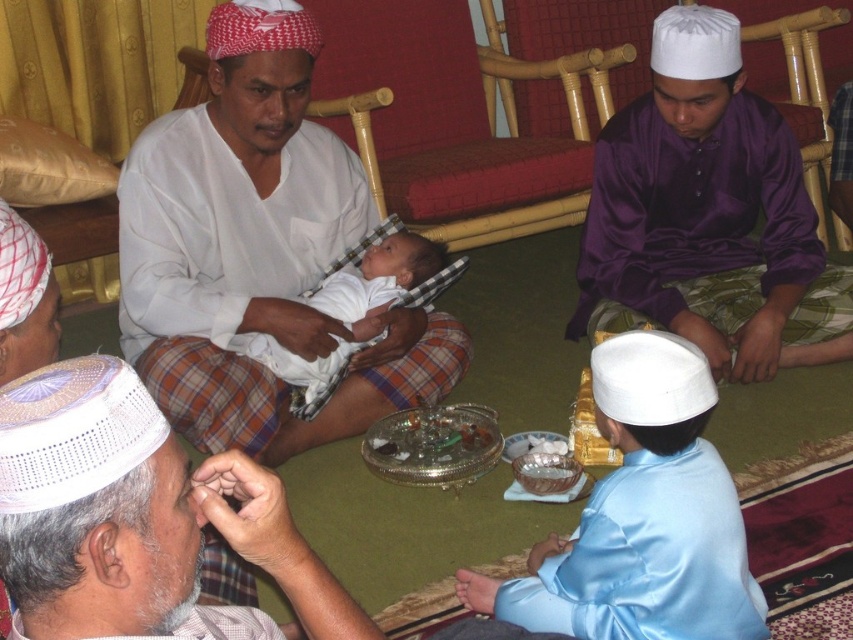
Question: Is white matte shirt at center below purple satin shirt at center?

Choices:
 (A) no
 (B) yes

Answer: (B)

Question: Which point is closer to the camera?

Choices:
 (A) (592, 608)
 (B) (328, 314)

Answer: (A)

Question: Observing the image, what is the correct spatial positioning of white woven cap at lower left in reference to light blue satin robe at lower right?

Choices:
 (A) right
 (B) left

Answer: (B)

Question: Which object is farther from the camera taking this photo?

Choices:
 (A) light blue satin robe at lower right
 (B) white woven cap at lower left
 (C) white cloth baby at center

Answer: (C)

Question: Does light blue satin robe at lower right appear on the left side of white cloth baby at center?

Choices:
 (A) no
 (B) yes

Answer: (A)

Question: Which object appears closest to the camera in this image?

Choices:
 (A) light blue satin robe at lower right
 (B) white woven cap at lower left
 (C) purple satin shirt at center
 (D) white cloth baby at center

Answer: (B)